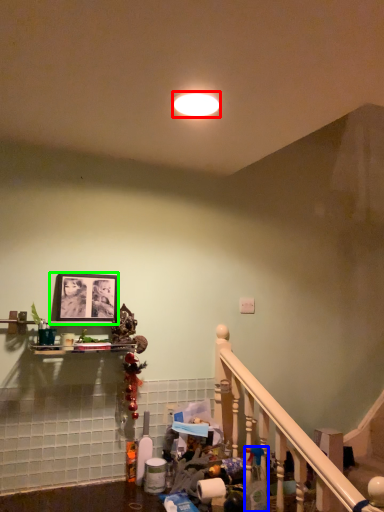
Question: Based on their relative distances, which object is nearer to lighting (highlighted by a red box)? Choose from cleaning product (highlighted by a blue box) and picture frame (highlighted by a green box).

Choices:
 (A) cleaning product
 (B) picture frame

Answer: (B)